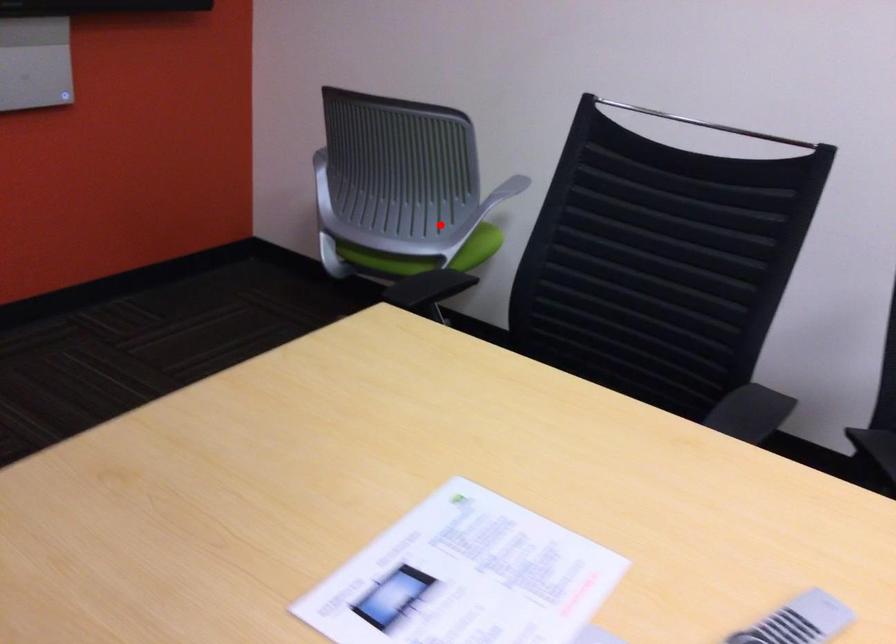
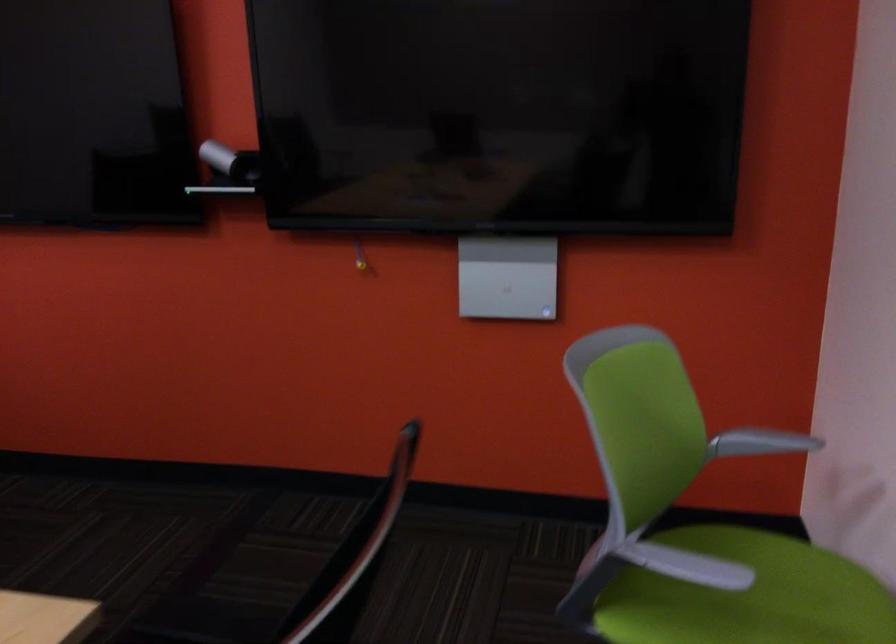
The point at the highlighted location is marked in the first image. Where is the corresponding point in the second image?

(747, 596)